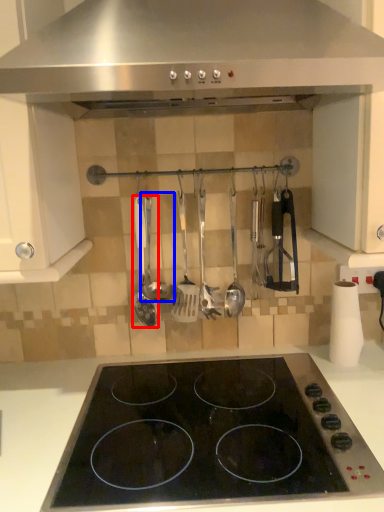
Question: Which object is further to the camera taking this photo, spatula (highlighted by a red box) or utensil (highlighted by a blue box)?

Choices:
 (A) spatula
 (B) utensil

Answer: (A)